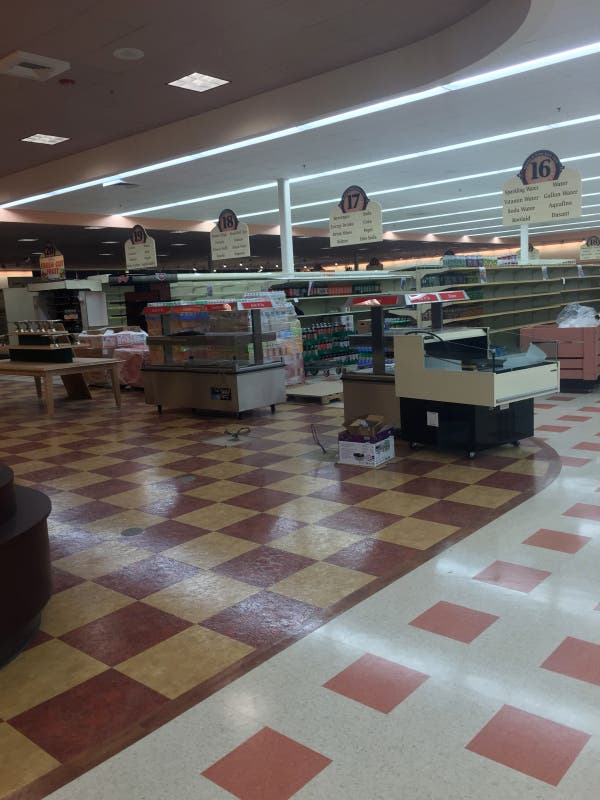
Locate an element on the screen. This screenshot has width=600, height=800. white and red checkered floor is located at coordinates (461, 682).